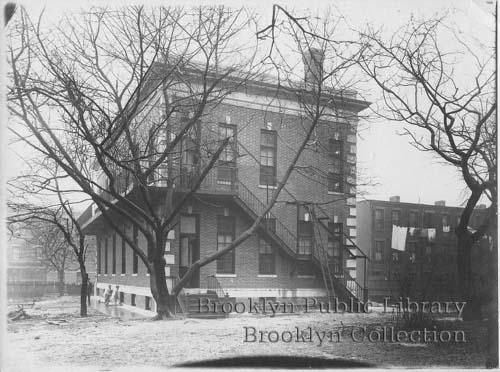
This screenshot has width=500, height=372. In order to click on sheet in this screenshot , I will do `click(395, 239)`.